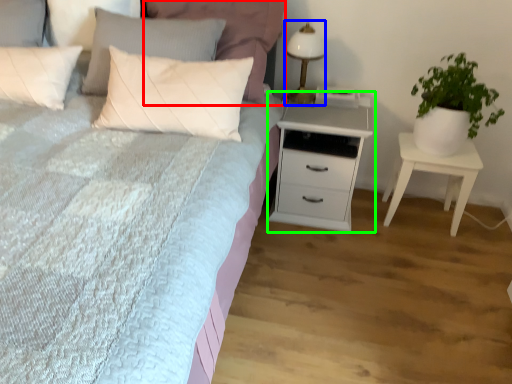
Question: Which object is positioned farthest from pillow (highlighted by a red box)? Select from bedside lamp (highlighted by a blue box) and chest of drawers (highlighted by a green box).

Choices:
 (A) bedside lamp
 (B) chest of drawers

Answer: (B)